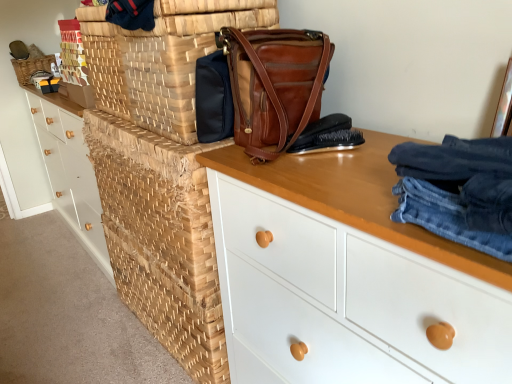
Question: Should I look upward or downward to see white matte chest of drawers at center, which is the 2th chest of drawers from left to right?

Choices:
 (A) down
 (B) up

Answer: (A)

Question: Is white matte chest of drawers at center, which is the 2th chest of drawers from left to right, far away from woven wood basket at center?

Choices:
 (A) no
 (B) yes

Answer: (A)

Question: Does white matte chest of drawers at center, which is the 2th chest of drawers from left to right, touch woven wood basket at center?

Choices:
 (A) yes
 (B) no

Answer: (B)

Question: Can you confirm if white matte chest of drawers at center, positioned as the first chest of drawers in front-to-back order, is shorter than woven wood basket at center?

Choices:
 (A) yes
 (B) no

Answer: (B)

Question: From a real-world perspective, does white matte chest of drawers at center, which is the 2th chest of drawers from left to right, stand above woven wood basket at center?

Choices:
 (A) yes
 (B) no

Answer: (B)

Question: From the image's perspective, is white matte chest of drawers at center, which is counted as the 2th chest of drawers, starting from the back, on woven wood basket at center?

Choices:
 (A) no
 (B) yes

Answer: (A)

Question: Considering the relative sizes of white matte chest of drawers at center, which appears as the first chest of drawers when viewed from the right, and woven wood basket at center in the image provided, is white matte chest of drawers at center, which appears as the first chest of drawers when viewed from the right, taller than woven wood basket at center?

Choices:
 (A) no
 (B) yes

Answer: (B)

Question: Can you confirm if woven wood chest of drawers at left, the 1th chest of drawers in the back-to-front sequence, is thinner than white matte chest of drawers at center, which is the 2th chest of drawers from left to right?

Choices:
 (A) no
 (B) yes

Answer: (B)

Question: From a real-world perspective, is woven wood chest of drawers at left, positioned as the second chest of drawers in right-to-left order, over white matte chest of drawers at center, which appears as the first chest of drawers when viewed from the right?

Choices:
 (A) yes
 (B) no

Answer: (A)

Question: Would you say woven wood chest of drawers at left, positioned as the second chest of drawers in right-to-left order, is a long distance from white matte chest of drawers at center, which is counted as the 2th chest of drawers, starting from the back?

Choices:
 (A) no
 (B) yes

Answer: (B)

Question: Is woven wood chest of drawers at left, positioned as the second chest of drawers in right-to-left order, at the left side of white matte chest of drawers at center, which appears as the first chest of drawers when viewed from the right?

Choices:
 (A) yes
 (B) no

Answer: (A)

Question: Is woven wood chest of drawers at left, marked as the first chest of drawers in a left-to-right arrangement, turned away from white matte chest of drawers at center, which is the 2th chest of drawers from left to right?

Choices:
 (A) yes
 (B) no

Answer: (B)

Question: Is woven wood chest of drawers at left, the 1th chest of drawers in the back-to-front sequence, smaller than white matte chest of drawers at center, which is counted as the 2th chest of drawers, starting from the back?

Choices:
 (A) no
 (B) yes

Answer: (A)

Question: Is brown woven basket at center, which is the 2th basket from top to bottom, to the left of woven wood basket at center from the viewer's perspective?

Choices:
 (A) no
 (B) yes

Answer: (A)